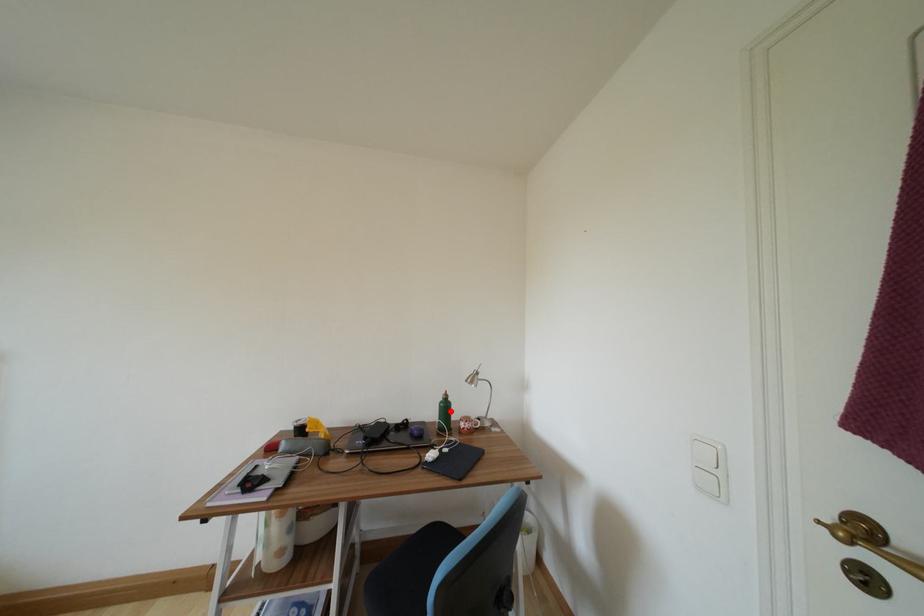
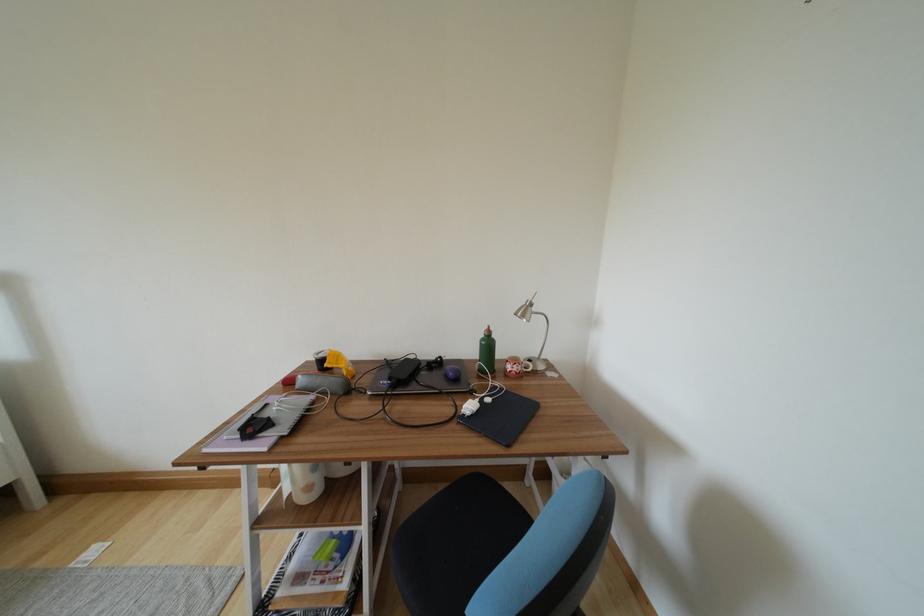
Where in the second image is the point corresponding to the highlighted location from the first image?

(493, 349)